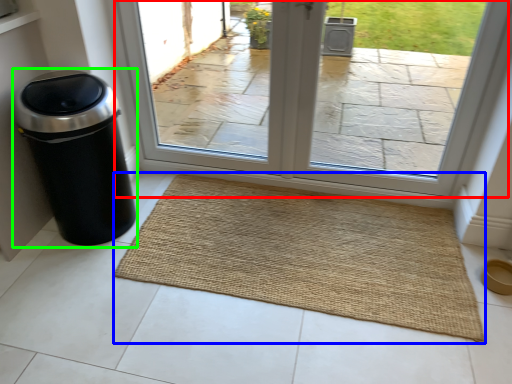
Question: Which object is positioned farthest from window (highlighted by a red box)? Select from mat (highlighted by a blue box) and waste container (highlighted by a green box).

Choices:
 (A) mat
 (B) waste container

Answer: (B)